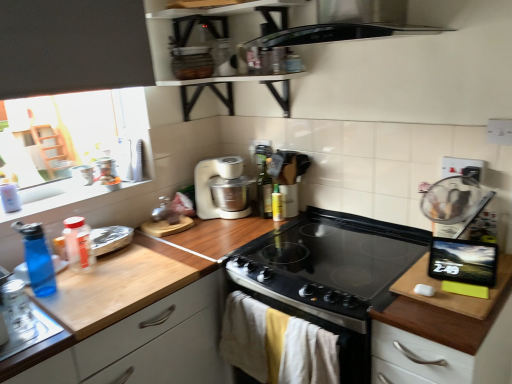
Question: Is translucent plastic bottle at left, which appears as the third bottle when viewed from the back, turned away from black glass gas stove at center?

Choices:
 (A) yes
 (B) no

Answer: (B)

Question: From a real-world perspective, does translucent plastic bottle at left, which appears as the 2th bottle when viewed from the left, sit lower than black glass gas stove at center?

Choices:
 (A) yes
 (B) no

Answer: (B)

Question: Does translucent plastic bottle at left, which appears as the third bottle when viewed from the back, have a larger size compared to black glass gas stove at center?

Choices:
 (A) no
 (B) yes

Answer: (A)

Question: Is translucent plastic bottle at left, which appears as the third bottle when viewed from the back, facing towards black glass gas stove at center?

Choices:
 (A) yes
 (B) no

Answer: (B)

Question: Is translucent plastic bottle at left, which appears as the third bottle when viewed from the back, positioned beyond the bounds of black glass gas stove at center?

Choices:
 (A) yes
 (B) no

Answer: (A)

Question: From a real-world perspective, is clear glass jar at left above or below translucent plastic bottle at left, which appears as the third bottle when viewed from the back?

Choices:
 (A) below
 (B) above

Answer: (A)

Question: Is clear glass jar at left to the left or to the right of translucent plastic bottle at left, which appears as the third bottle when viewed from the back, in the image?

Choices:
 (A) left
 (B) right

Answer: (A)

Question: Is clear glass jar at left inside the boundaries of translucent plastic bottle at left, arranged as the second bottle when viewed from the front, or outside?

Choices:
 (A) outside
 (B) inside

Answer: (A)

Question: Is point (20, 311) closer or farther from the camera than point (90, 261)?

Choices:
 (A) farther
 (B) closer

Answer: (B)

Question: Considering the positions of white matte food processor at center and black glass gas stove at center in the image, is white matte food processor at center bigger or smaller than black glass gas stove at center?

Choices:
 (A) big
 (B) small

Answer: (B)

Question: In terms of width, does white matte food processor at center look wider or thinner when compared to black glass gas stove at center?

Choices:
 (A) wide
 (B) thin

Answer: (B)

Question: Is white matte food processor at center inside the boundaries of black glass gas stove at center, or outside?

Choices:
 (A) outside
 (B) inside

Answer: (A)

Question: Based on their positions, is white matte food processor at center located to the left or right of black glass gas stove at center?

Choices:
 (A) right
 (B) left

Answer: (B)

Question: From a real-world perspective, is blue translucent bottle at left, acting as the fourth bottle starting from the right, positioned above or below translucent plastic bottle at left, arranged as the second bottle when viewed from the front?

Choices:
 (A) above
 (B) below

Answer: (A)

Question: From the image's perspective, is blue translucent bottle at left, placed as the first bottle when sorted from front to back, positioned above or below translucent plastic bottle at left, which appears as the 2th bottle when viewed from the left?

Choices:
 (A) above
 (B) below

Answer: (B)